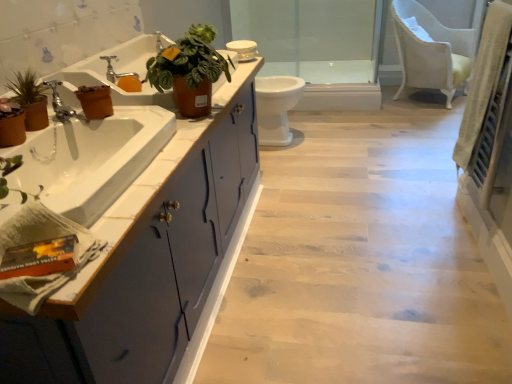
In order to click on transparent glass door at center in this screenshot , I will do `click(312, 37)`.

This screenshot has height=384, width=512. What do you see at coordinates (312, 37) in the screenshot?
I see `transparent glass door at center` at bounding box center [312, 37].

Where is `matte brown pot at left, arranged as the 2th houseplant when viewed from the right`? This screenshot has width=512, height=384. matte brown pot at left, arranged as the 2th houseplant when viewed from the right is located at coordinates (30, 99).

From the picture: What is the approximate height of brushed metal faucet at left, positioned as the second tap in back-to-front order?

brushed metal faucet at left, positioned as the second tap in back-to-front order, is 4.83 inches tall.

The image size is (512, 384). Describe the element at coordinates (62, 104) in the screenshot. I see `brushed metal faucet at left, which is the first tap in front-to-back order` at that location.

Where is `matte blue cabinet at left`? This screenshot has height=384, width=512. matte blue cabinet at left is located at coordinates (147, 260).

What are the coordinates of `transparent glass door at center` in the screenshot? It's located at (312, 37).

Considering the relative sizes of brown terracotta pot at left, which is the second flowerpot in bottom-to-top order, and white fabric chair at upper right in the image provided, is brown terracotta pot at left, which is the second flowerpot in bottom-to-top order, shorter than white fabric chair at upper right?

Correct, brown terracotta pot at left, which is the second flowerpot in bottom-to-top order, is not as tall as white fabric chair at upper right.

Is brown terracotta pot at left, which is the second flowerpot in left-to-right order, not within white fabric chair at upper right?

Absolutely, brown terracotta pot at left, which is the second flowerpot in left-to-right order, is external to white fabric chair at upper right.

Could you tell me if brown terracotta pot at left, which is the second flowerpot in bottom-to-top order, is facing white fabric chair at upper right?

No, brown terracotta pot at left, which is the second flowerpot in bottom-to-top order, is not facing towards white fabric chair at upper right.

From a real-world perspective, is brown terracotta pot at left, which ranks as the 2th flowerpot in front-to-back order, above or below white fabric chair at upper right?

From a real-world perspective, brown terracotta pot at left, which ranks as the 2th flowerpot in front-to-back order, is physically above white fabric chair at upper right.

Who is smaller, brown terracotta pot at left, which is the second flowerpot in bottom-to-top order, or matte brown flowerpot at left, arranged as the first flowerpot when ordered from the bottom?

Smaller between the two is brown terracotta pot at left, which is the second flowerpot in bottom-to-top order.

Would you say brown terracotta pot at left, which is the second flowerpot in bottom-to-top order, is to the left or to the right of matte brown flowerpot at left, acting as the second flowerpot starting from the back, in the picture?

brown terracotta pot at left, which is the second flowerpot in bottom-to-top order, is to the right of matte brown flowerpot at left, acting as the second flowerpot starting from the back.

What's the angular difference between brown terracotta pot at left, which is the first flowerpot in back-to-front order, and matte brown flowerpot at left, the 2th flowerpot from the right,'s facing directions?

There is a 4.5-degree angle between the facing directions of brown terracotta pot at left, which is the first flowerpot in back-to-front order, and matte brown flowerpot at left, the 2th flowerpot from the right.

Is brown terracotta pot at left, the first flowerpot in the top-to-bottom sequence, not inside matte brown flowerpot at left, the first flowerpot viewed from the front?

Absolutely, brown terracotta pot at left, the first flowerpot in the top-to-bottom sequence, is external to matte brown flowerpot at left, the first flowerpot viewed from the front.

Based on the photo, between leather-like terracotta pot at upper center, positioned as the second houseplant in left-to-right order, and matte blue cabinet at left, which one is positioned in front?

matte blue cabinet at left is in front.

Is leather-like terracotta pot at upper center, positioned as the second houseplant in left-to-right order, bigger or smaller than matte blue cabinet at left?

Clearly, leather-like terracotta pot at upper center, positioned as the second houseplant in left-to-right order, is smaller in size than matte blue cabinet at left.

Find the location of a particular element. houseplant that is on the right side of matte blue cabinet at left is located at coordinates (189, 70).

Does leather-like terracotta pot at upper center, positioned as the second houseplant in left-to-right order, have a greater width compared to matte blue cabinet at left?

Incorrect, the width of leather-like terracotta pot at upper center, positioned as the second houseplant in left-to-right order, does not surpass that of matte blue cabinet at left.

In terms of height, does brushed metal faucet at left, positioned as the second tap in back-to-front order, look taller or shorter compared to brown terracotta pot at left, the first flowerpot in the top-to-bottom sequence?

brushed metal faucet at left, positioned as the second tap in back-to-front order, is taller than brown terracotta pot at left, the first flowerpot in the top-to-bottom sequence.

Locate an element on the screen. This screenshot has width=512, height=384. tap lying in front of the brown terracotta pot at left, which is the first flowerpot in back-to-front order is located at coordinates (62, 104).

Does point (61, 101) lie in front of point (106, 87)?

Yes.

Are silver metallic faucet at upper left, positioned as the second tap in bottom-to-top order, and brown terracotta pot at left, which ranks as the 2th flowerpot in front-to-back order, beside each other?

No, silver metallic faucet at upper left, positioned as the second tap in bottom-to-top order, is not with brown terracotta pot at left, which ranks as the 2th flowerpot in front-to-back order.

Does silver metallic faucet at upper left, positioned as the second tap in bottom-to-top order, have a larger size compared to brown terracotta pot at left, which is the second flowerpot in bottom-to-top order?

No.

Is silver metallic faucet at upper left, which is the second tap in front-to-back order, facing away from brown terracotta pot at left, the first flowerpot in the top-to-bottom sequence?

silver metallic faucet at upper left, which is the second tap in front-to-back order, does not have its back to brown terracotta pot at left, the first flowerpot in the top-to-bottom sequence.

From a real-world perspective, is silver metallic faucet at upper left, which appears as the 1th tap when viewed from the top, physically above brown terracotta pot at left, which is the first flowerpot in back-to-front order?

Indeed, from a real-world perspective, silver metallic faucet at upper left, which appears as the 1th tap when viewed from the top, stands above brown terracotta pot at left, which is the first flowerpot in back-to-front order.

Which object is wider, silver metallic faucet at upper left, which is the second tap in front-to-back order, or white fabric chair at upper right?

white fabric chair at upper right.

From the image's perspective, which object appears higher, silver metallic faucet at upper left, which appears as the 1th tap when viewed from the top, or white fabric chair at upper right?

white fabric chair at upper right.

Is point (121, 81) closer or farther from the camera than point (464, 74)?

Point (121, 81).

Which object is further away from the camera, white fabric chair at upper right or white glossy toilet at center?

Positioned behind is white fabric chair at upper right.

Is white fabric chair at upper right thinner than white glossy toilet at center?

No, white fabric chair at upper right is not thinner than white glossy toilet at center.

Is point (450, 48) positioned after point (290, 99)?

Yes, it is.

How many degrees apart are the facing directions of white fabric chair at upper right and white glossy toilet at center?

28.7 degrees separate the facing orientations of white fabric chair at upper right and white glossy toilet at center.

This screenshot has height=384, width=512. Identify the location of chair below the brown terracotta pot at left, which is the first flowerpot in back-to-front order (from a real-world perspective). (431, 50).

The width and height of the screenshot is (512, 384). Identify the location of flowerpot behind the matte brown flowerpot at left, the first flowerpot viewed from the front. (95, 101).

From the image, which object appears to be nearer to white glossy toilet at center, transparent glass door at center or matte brown flowerpot at left, the 2th flowerpot from the right?

transparent glass door at center is positioned closer to the anchor white glossy toilet at center.

Looking at the image, which one is located closer to silver metallic faucet at upper left, the first tap positioned from the back, matte brown flowerpot at left, the first flowerpot viewed from the left, or brown terracotta pot at left, which is the first flowerpot in back-to-front order?

brown terracotta pot at left, which is the first flowerpot in back-to-front order, is positioned closer to the anchor silver metallic faucet at upper left, the first tap positioned from the back.

Which object lies further to the anchor point silver metallic faucet at upper left, which is the second tap in front-to-back order, white fabric chair at upper right or transparent glass door at center?

The object further to silver metallic faucet at upper left, which is the second tap in front-to-back order, is transparent glass door at center.

Considering their positions, is matte brown pot at left, which is counted as the first houseplant, starting from the left, positioned further to leather-like terracotta pot at upper center, which appears as the 1th houseplant when viewed from the right, than white fabric chair at upper right?

white fabric chair at upper right lies further to leather-like terracotta pot at upper center, which appears as the 1th houseplant when viewed from the right, than the other object.

In the scene shown: Considering their positions, is transparent glass door at center positioned closer to brown terracotta pot at left, which is the 1th flowerpot from right to left, than silver metallic faucet at upper left, which appears as the 1th tap when viewed from the top?

Among the two, silver metallic faucet at upper left, which appears as the 1th tap when viewed from the top, is located nearer to brown terracotta pot at left, which is the 1th flowerpot from right to left.

From the image, which object appears to be farther from brushed metal faucet at left, which is the 2th tap in top-to-bottom order, silver metallic faucet at upper left, positioned as the second tap in bottom-to-top order, or leather-like terracotta pot at upper center, positioned as the second houseplant in left-to-right order?

leather-like terracotta pot at upper center, positioned as the second houseplant in left-to-right order, lies further to brushed metal faucet at left, which is the 2th tap in top-to-bottom order, than the other object.

Looking at the image, which one is located further to silver metallic faucet at upper left, which appears as the 1th tap when viewed from the top, brushed metal faucet at left, the 1th tap when ordered from bottom to top, or matte brown pot at left, which is counted as the first houseplant, starting from the left?

matte brown pot at left, which is counted as the first houseplant, starting from the left, is positioned further to the anchor silver metallic faucet at upper left, which appears as the 1th tap when viewed from the top.

Which object lies nearer to the anchor point matte brown flowerpot at left, arranged as the first flowerpot when ordered from the bottom, transparent glass door at center or white glossy toilet at center?

white glossy toilet at center is closer to matte brown flowerpot at left, arranged as the first flowerpot when ordered from the bottom.

Image resolution: width=512 pixels, height=384 pixels. I want to click on toilet between brown terracotta pot at left, which is the first flowerpot in back-to-front order, and transparent glass door at center from front to back, so click(276, 107).

Where is `tap between brown terracotta pot at left, the first flowerpot in the top-to-bottom sequence, and transparent glass door at center, along the z-axis`? Image resolution: width=512 pixels, height=384 pixels. tap between brown terracotta pot at left, the first flowerpot in the top-to-bottom sequence, and transparent glass door at center, along the z-axis is located at coordinates (122, 77).

You are a GUI agent. You are given a task and a screenshot of the screen. Output one action in this format:
    pyautogui.click(x=<x>, y=<y>)
    Task: Click on the flowerpot between matte blue cabinet at left and matte brown pot at left, arranged as the 2th houseplant when viewed from the right, in the front-back direction
    The width and height of the screenshot is (512, 384).
    Given the screenshot: What is the action you would take?
    pyautogui.click(x=12, y=129)

Where is `flowerpot between matte brown pot at left, arranged as the 2th houseplant when viewed from the right, and white glossy toilet at center, along the z-axis`? The height and width of the screenshot is (384, 512). flowerpot between matte brown pot at left, arranged as the 2th houseplant when viewed from the right, and white glossy toilet at center, along the z-axis is located at coordinates (95, 101).